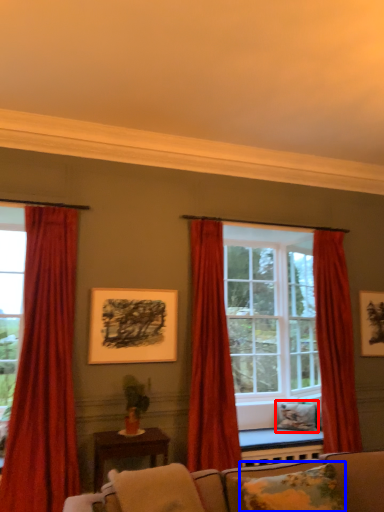
Question: Which of the following is the farthest to the observer, pillow (highlighted by a red box) or pillow (highlighted by a blue box)?

Choices:
 (A) pillow
 (B) pillow

Answer: (A)